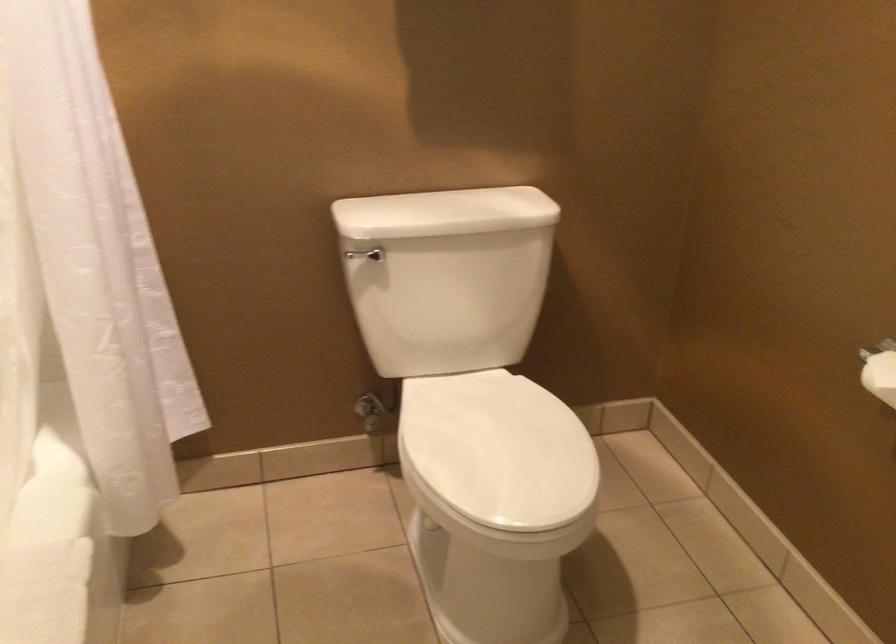
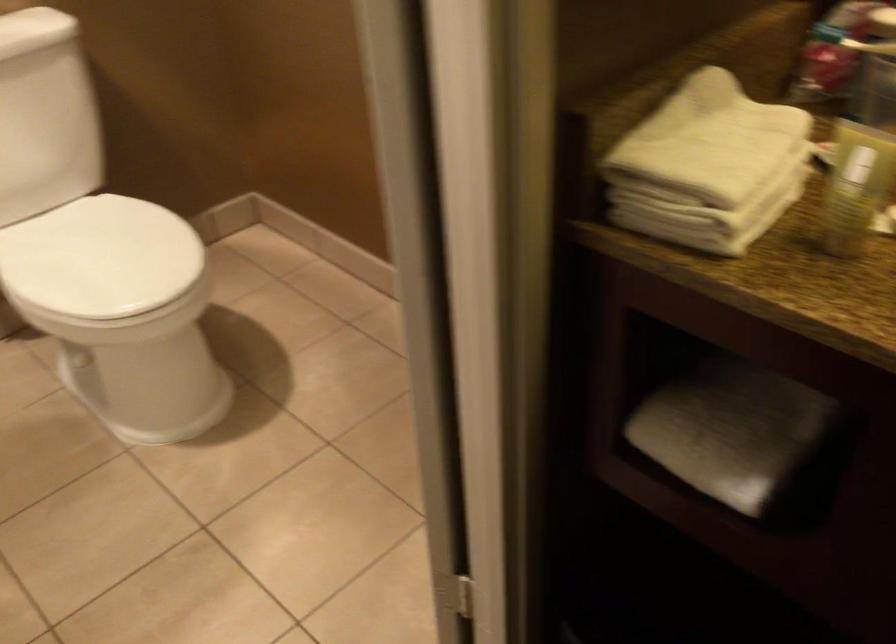
Question: I am providing you with two images of the same scene from different viewpoints. Which of the following objects are not visible in image2?

Choices:
 (A) amber candle holder
 (B) rolled white towel
 (C) toilet paper roll
 (D) white toilet lid

Answer: (C)